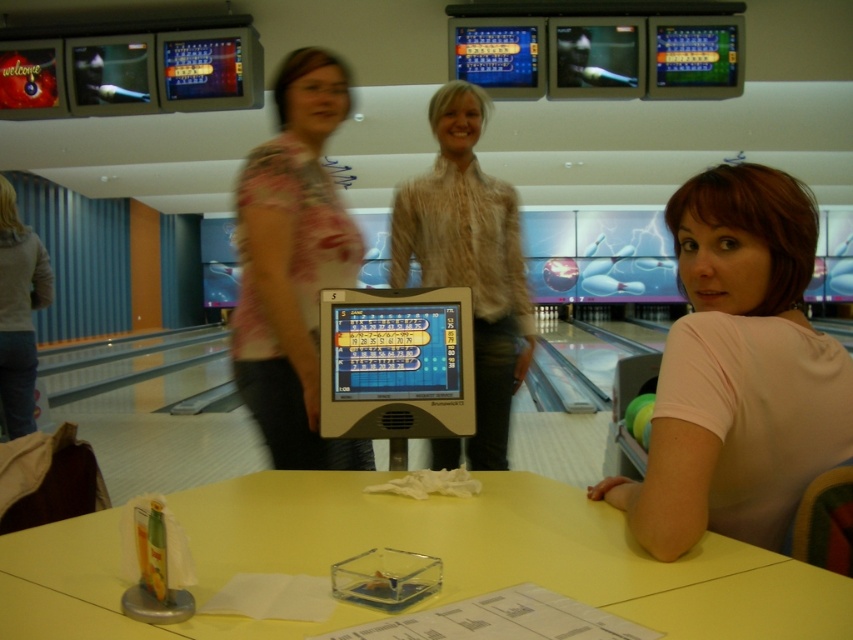
Question: Considering the relative positions of yellow plastic table at center and floral fabric blouse at center in the image provided, where is yellow plastic table at center located with respect to floral fabric blouse at center?

Choices:
 (A) left
 (B) right

Answer: (B)

Question: Which point is farther to the camera?

Choices:
 (A) denim pants at left
 (B) floral fabric blouse at center

Answer: (A)

Question: Does yellow plastic table at center appear under floral fabric blouse at center?

Choices:
 (A) no
 (B) yes

Answer: (B)

Question: Is floral fabric blouse at center closer to camera compared to denim pants at left?

Choices:
 (A) no
 (B) yes

Answer: (B)

Question: Which object is closer to the camera taking this photo?

Choices:
 (A) floral fabric blouse at center
 (B) yellow plastic table at center
 (C) light brown textured blouse at center

Answer: (B)

Question: Considering the real-world distances, which object is farthest from the floral fabric blouse at center?

Choices:
 (A) pink matte shirt at center
 (B) yellow plastic table at center
 (C) denim pants at left

Answer: (C)